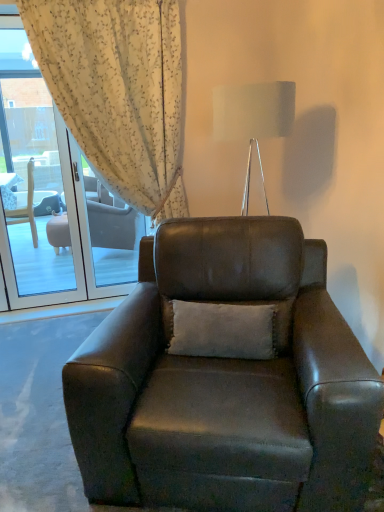
Question: Can you confirm if metallic silver lamp at upper center is bigger than white soft cushion at center?

Choices:
 (A) yes
 (B) no

Answer: (A)

Question: Is metallic silver lamp at upper center with white soft cushion at center?

Choices:
 (A) yes
 (B) no

Answer: (B)

Question: From a real-world perspective, is metallic silver lamp at upper center physically above white soft cushion at center?

Choices:
 (A) yes
 (B) no

Answer: (A)

Question: Is metallic silver lamp at upper center oriented towards white soft cushion at center?

Choices:
 (A) no
 (B) yes

Answer: (A)

Question: Is metallic silver lamp at upper center shorter than white soft cushion at center?

Choices:
 (A) yes
 (B) no

Answer: (B)

Question: From the image's perspective, is metallic silver lamp at upper center located above or below leather armchair at center?

Choices:
 (A) below
 (B) above

Answer: (B)

Question: Considering the positions of metallic silver lamp at upper center and leather armchair at center in the image, is metallic silver lamp at upper center bigger or smaller than leather armchair at center?

Choices:
 (A) small
 (B) big

Answer: (A)

Question: Visually, is metallic silver lamp at upper center positioned to the left or to the right of leather armchair at center?

Choices:
 (A) right
 (B) left

Answer: (A)

Question: Is metallic silver lamp at upper center taller or shorter than leather armchair at center?

Choices:
 (A) short
 (B) tall

Answer: (A)

Question: Is leather armchair at center inside or outside of white floral fabric at upper left?

Choices:
 (A) inside
 (B) outside

Answer: (B)

Question: Looking at the image, does leather armchair at center seem bigger or smaller compared to white floral fabric at upper left?

Choices:
 (A) small
 (B) big

Answer: (B)

Question: From the image's perspective, is leather armchair at center located above or below white floral fabric at upper left?

Choices:
 (A) above
 (B) below

Answer: (B)

Question: Considering the positions of point (205, 249) and point (137, 202), is point (205, 249) closer or farther from the camera than point (137, 202)?

Choices:
 (A) farther
 (B) closer

Answer: (B)

Question: From the image's perspective, is white floral fabric at upper left positioned above or below white soft cushion at center?

Choices:
 (A) above
 (B) below

Answer: (A)

Question: Is point (77, 55) positioned closer to the camera than point (200, 321)?

Choices:
 (A) closer
 (B) farther

Answer: (B)